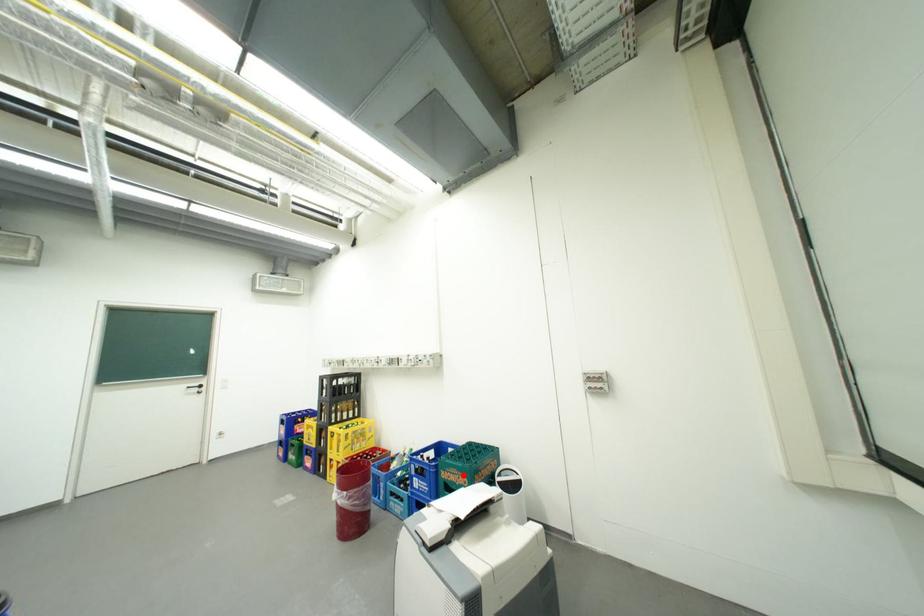
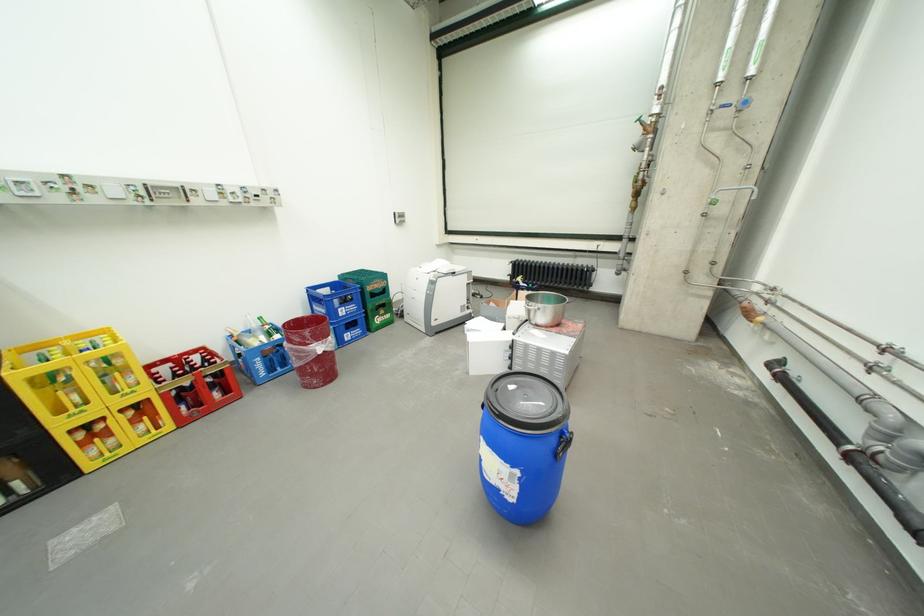
Question: I am providing you with two images of the same scene from different viewpoints. In image1, a red point is highlighted. Considering the same 3D point in image2, which of the following is correct?

Choices:
 (A) It is closer
 (B) It is farther

Answer: (A)